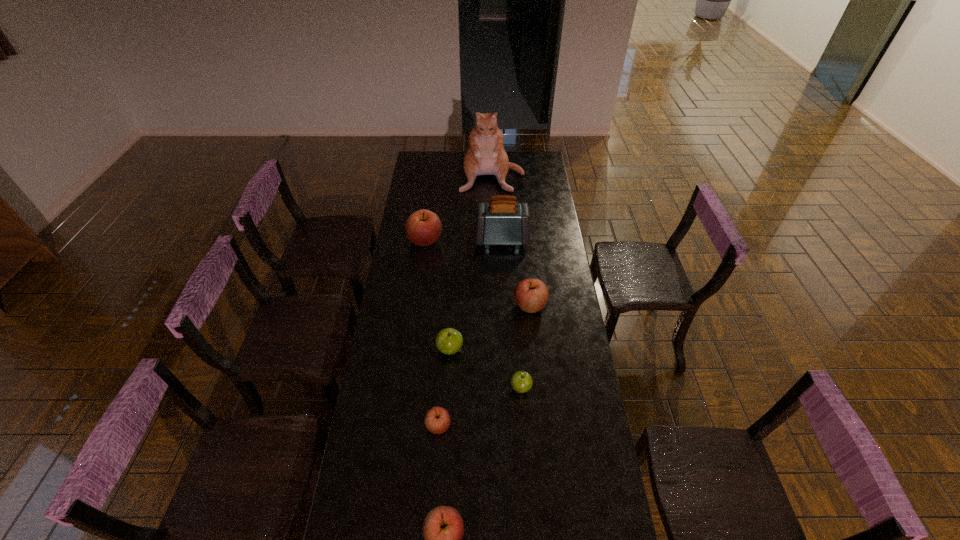
Locate an element on the screen. This screenshot has width=960, height=540. the right green apple is located at coordinates (521, 381).

Find the location of a particular element. the smallest red apple is located at coordinates (437, 420).

The image size is (960, 540). Find the location of `the second nearest apple`. the second nearest apple is located at coordinates (437, 420).

Where is `vacant space located on the face of the orange cat`? This screenshot has width=960, height=540. vacant space located on the face of the orange cat is located at coordinates click(x=493, y=211).

You are a GUI agent. You are given a task and a screenshot of the screen. Output one action in this format:
    pyautogui.click(x=<x>, y=<y>)
    Task: Click on the free location located on the front-facing side of the toaster
    
    Given the screenshot: What is the action you would take?
    pyautogui.click(x=413, y=240)

This screenshot has height=540, width=960. I want to click on free space located 0.150m on the front-facing side of the toaster, so click(x=444, y=240).

The image size is (960, 540). Find the location of `free space located 0.390m on the front-facing side of the toaster`. free space located 0.390m on the front-facing side of the toaster is located at coordinates (396, 240).

What are the coordinates of `vacant region located on the back of the tallest apple` in the screenshot? It's located at (430, 200).

Locate an element on the screen. Image resolution: width=960 pixels, height=540 pixels. vacant area situated 0.190m on the front of the second farthest red apple is located at coordinates (536, 357).

Find the location of a particular element. This screenshot has height=540, width=960. vacant space located on the back of the fifth farthest object is located at coordinates (453, 298).